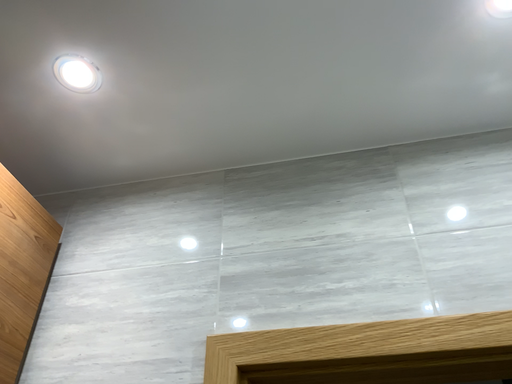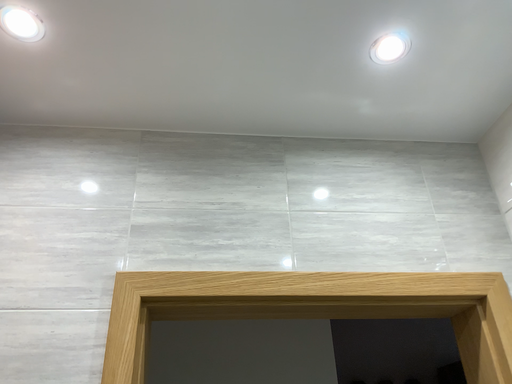
Question: How did the camera likely rotate when shooting the video?

Choices:
 (A) rotated upward
 (B) rotated downward

Answer: (B)